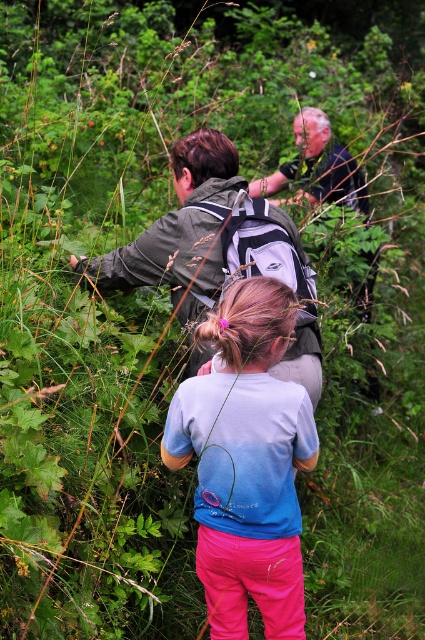
You are standing at point (302, 150) and want to walk to the young girl with her back to the camera. Is the point (308, 340) between you and the girl?

Yes, the point (308, 340) is between you and the young girl with her back to the camera because it is in front of point (302, 150).

You are a hiker trying to decide which clothing item to take off first. You see the light blue cotton shirt at center and the green fabric jacket at center. Which one is taller?

The light blue cotton shirt at center is taller than the green fabric jacket at center, so you should take off the light blue cotton shirt at center first if you want to remove the taller item first.